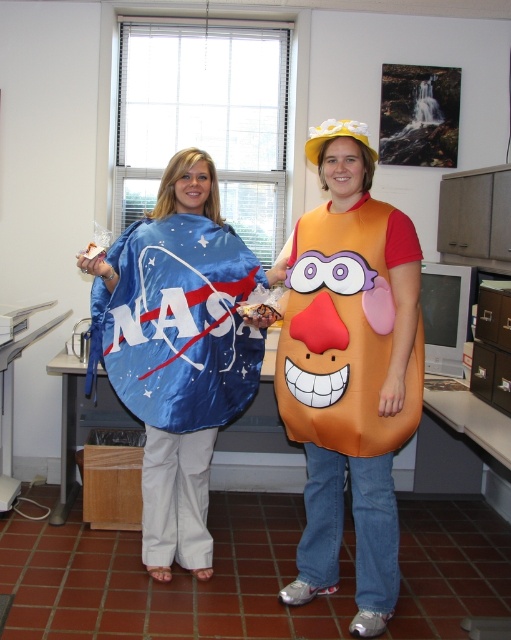
Question: Is shiny blue nasa cape at left to the right of blue fabric nasa cape at left from the viewer's perspective?

Choices:
 (A) no
 (B) yes

Answer: (B)

Question: Does shiny blue nasa cape at left appear over blue fabric nasa cape at left?

Choices:
 (A) yes
 (B) no

Answer: (B)

Question: Can you confirm if shiny blue nasa cape at left is smaller than orange fabric potato at center?

Choices:
 (A) no
 (B) yes

Answer: (A)

Question: Which of the following is the closest to the observer?

Choices:
 (A) blue fabric nasa cape at left
 (B) orange fabric potato at center
 (C) shiny blue nasa cape at left

Answer: (B)

Question: Which of the following is the closest to the observer?

Choices:
 (A) (316, 358)
 (B) (332, 253)
 (C) (185, 257)

Answer: (A)

Question: Which object is farther from the camera taking this photo?

Choices:
 (A) orange fabric potato at center
 (B) shiny blue nasa cape at left
 (C) blue fabric nasa cape at left

Answer: (C)